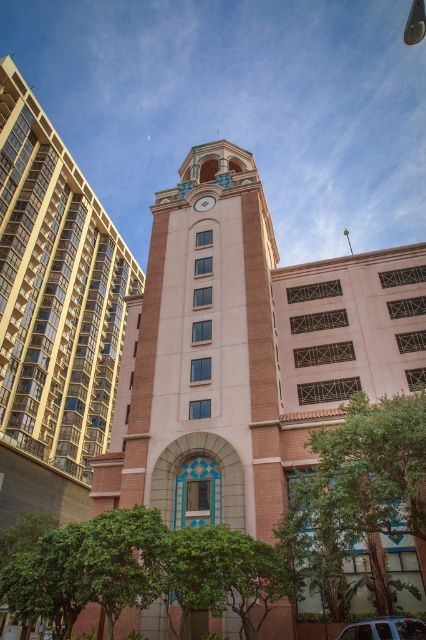
Question: Which point is closer to the camera?

Choices:
 (A) green leafy tree at lower right
 (B) metallic silver car at center

Answer: (B)

Question: Does beige brick clock tower at center appear under green leafy tree at lower center?

Choices:
 (A) no
 (B) yes

Answer: (A)

Question: Can you confirm if beige brick clock tower at center is wider than green leafy tree at lower right?

Choices:
 (A) yes
 (B) no

Answer: (A)

Question: Is green leafy tree at lower center to the right of metallic silver car at center from the viewer's perspective?

Choices:
 (A) no
 (B) yes

Answer: (A)

Question: Which of these objects is positioned closest to the matte gold clock at center?

Choices:
 (A) green leafy tree at lower right
 (B) brick clock tower at center

Answer: (B)

Question: Considering the real-world distances, which object is closest to the green leafy tree at lower center?

Choices:
 (A) brick clock tower at center
 (B) matte gold clock at center
 (C) green leafy tree at lower right
 (D) metallic silver car at center

Answer: (C)